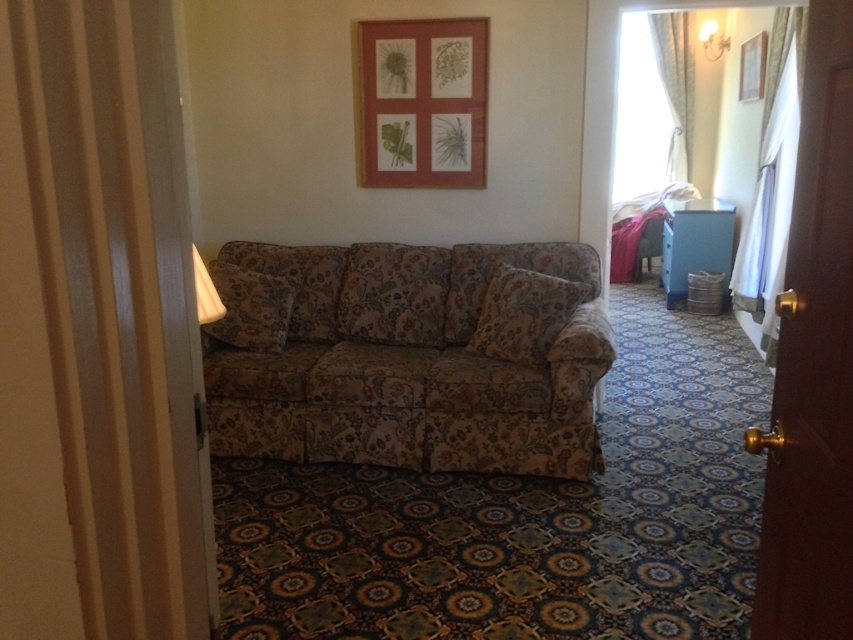
You are planning to rearrange the living room and want to place a large potted plant between the floral fabric couch at center and the floral fabric armchair at center. Given that the couch is larger, which side of the plant should be closer to the couch to maintain balance?

Since the floral fabric couch at center is larger than the floral fabric armchair at center, the larger side of the plant should be closer to the couch to maintain balance.

You are standing at the doorway and want to place a new plant on the floor between the floral fabric couch at center and the wooden picture frame at upper center. Which object should you move closer to the center of the room to make space?

To make space between the floral fabric couch at center and the wooden picture frame at upper center, you should move the floral fabric couch at center closer to the center of the room since it is currently to the left of the wooden picture frame at upper center.

You are standing in the doorway of the living space. You want to hang a new picture exactly where the wooden picture frame at upper center is currently located. What are the coordinates of the spot where you should place the new picture?

The wooden picture frame at upper center is positioned at coordinates point [421,102], so you should place the new picture at those coordinates.